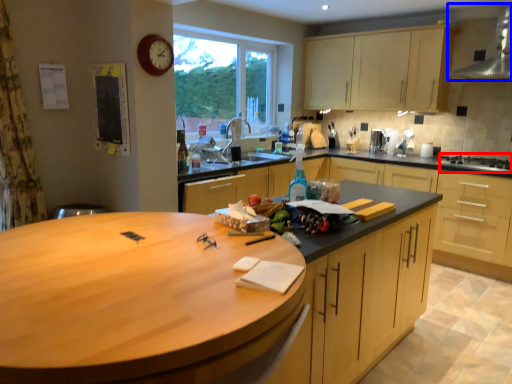
Question: Among these objects, which one is farthest to the camera, gas stove (highlighted by a red box) or exhaust hood (highlighted by a blue box)?

Choices:
 (A) gas stove
 (B) exhaust hood

Answer: (A)